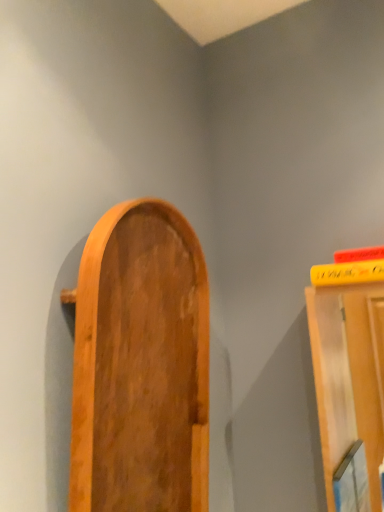
Question: Is yellow matte book at upper right situated inside wooden door at center or outside?

Choices:
 (A) outside
 (B) inside

Answer: (A)

Question: Based on their sizes in the image, would you say yellow matte book at upper right is bigger or smaller than wooden door at center?

Choices:
 (A) small
 (B) big

Answer: (A)

Question: Is yellow matte book at upper right to the left or to the right of wooden door at center in the image?

Choices:
 (A) left
 (B) right

Answer: (B)

Question: From their relative heights in the image, would you say wooden door at center is taller or shorter than yellow matte book at upper right?

Choices:
 (A) short
 (B) tall

Answer: (B)

Question: Is point (145, 336) positioned closer to the camera than point (319, 282)?

Choices:
 (A) farther
 (B) closer

Answer: (B)

Question: Would you say wooden door at center is to the left or to the right of yellow matte book at upper right in the picture?

Choices:
 (A) right
 (B) left

Answer: (B)

Question: Is wooden door at center spatially inside yellow matte book at upper right, or outside of it?

Choices:
 (A) inside
 (B) outside

Answer: (B)